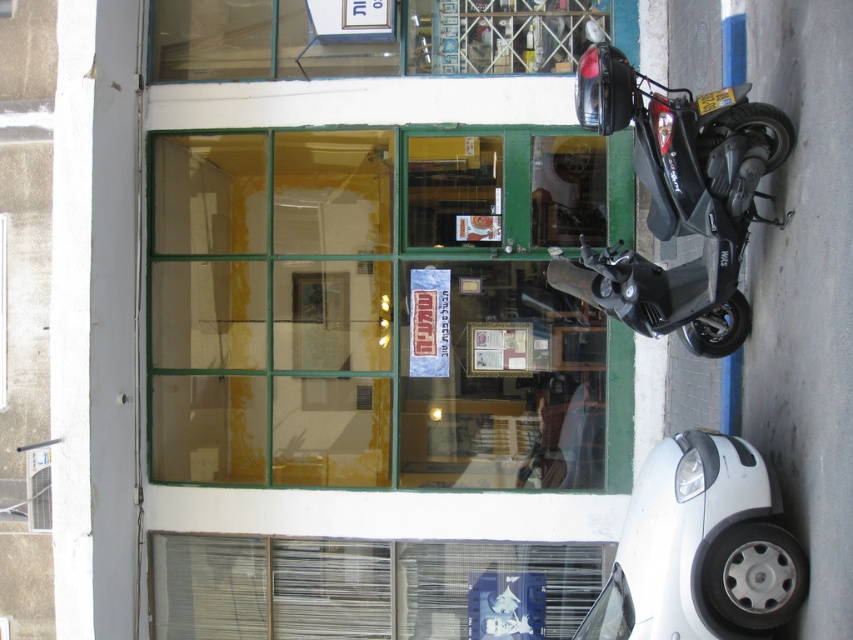
Question: Is green glass shop window at center bigger than matte black scooter at right?

Choices:
 (A) no
 (B) yes

Answer: (B)

Question: Can you confirm if matte black scooter at right is positioned above transparent glass window at upper center?

Choices:
 (A) no
 (B) yes

Answer: (A)

Question: Which point is farther to the camera?

Choices:
 (A) (488, 230)
 (B) (759, 148)
 (C) (637, 584)

Answer: (A)

Question: Does green glass shop window at center appear on the left side of matte black scooter at right?

Choices:
 (A) yes
 (B) no

Answer: (A)

Question: Which of the following is the closest to the observer?

Choices:
 (A) green glass shop window at center
 (B) transparent glass window at upper center
 (C) matte black scooter at right

Answer: (C)

Question: Which point appears farthest from the camera in this image?

Choices:
 (A) (614, 634)
 (B) (194, 205)
 (C) (521, 42)

Answer: (B)